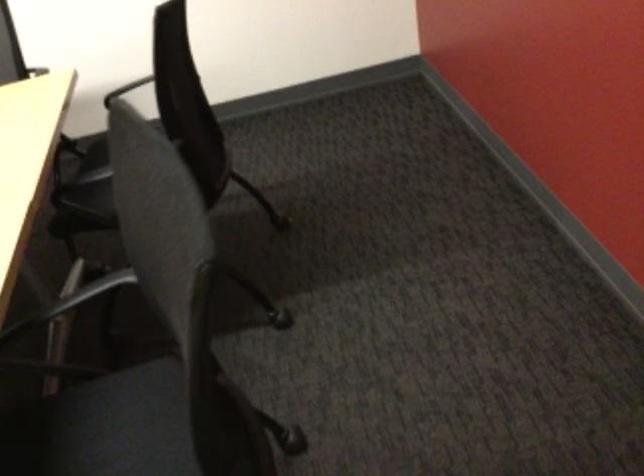
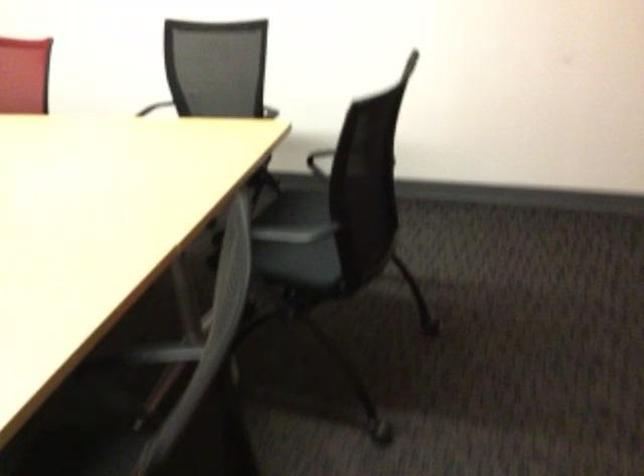
The images are taken continuously from a first-person perspective. In which direction are you moving?

The cameraman moved toward right, forward.